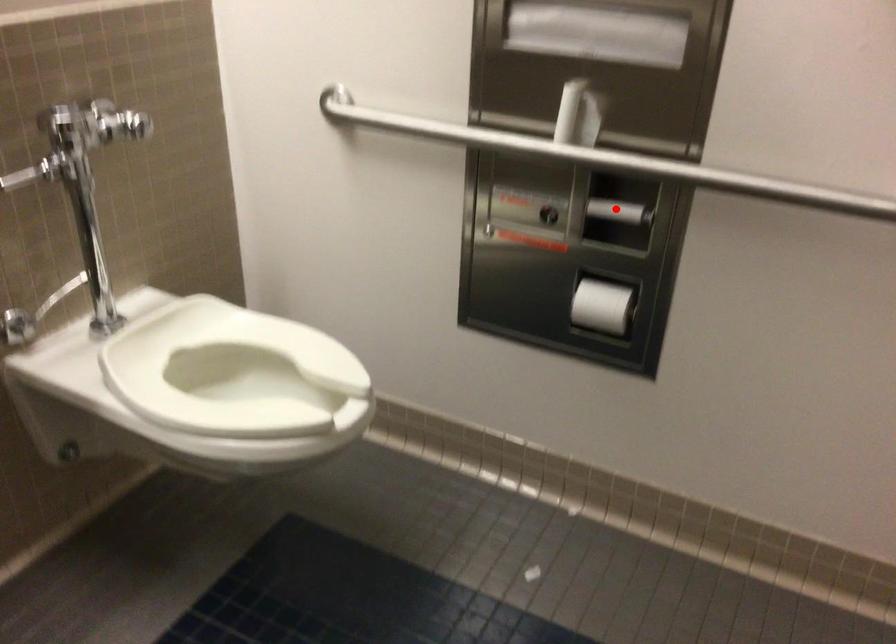
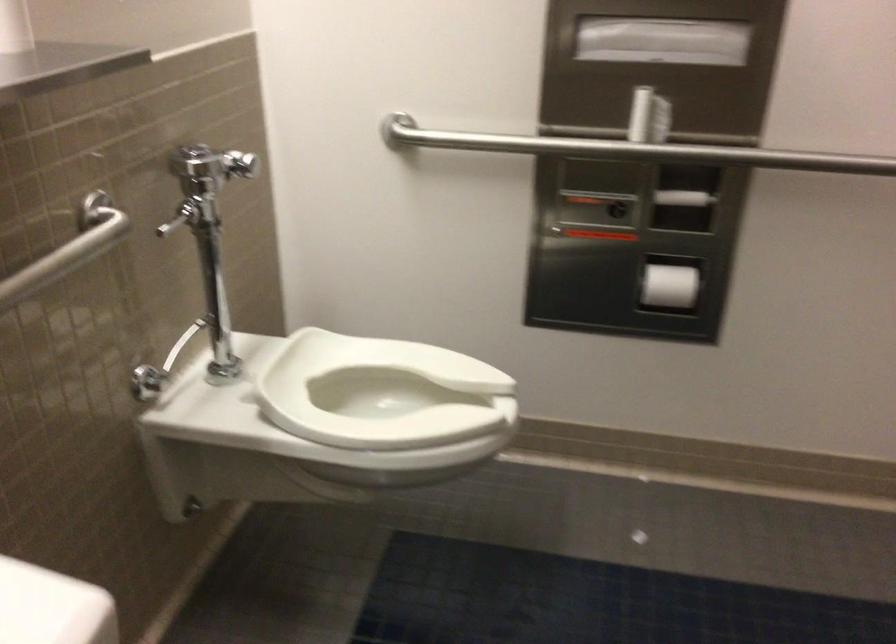
In the second image, find the point that corresponds to the highlighted location in the first image.

(683, 198)